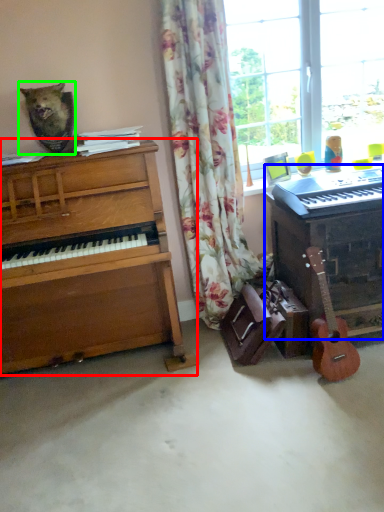
Question: Based on their relative distances, which object is farther from piano (highlighted by a red box)? Choose from piano (highlighted by a blue box) and animal (highlighted by a green box).

Choices:
 (A) piano
 (B) animal

Answer: (A)